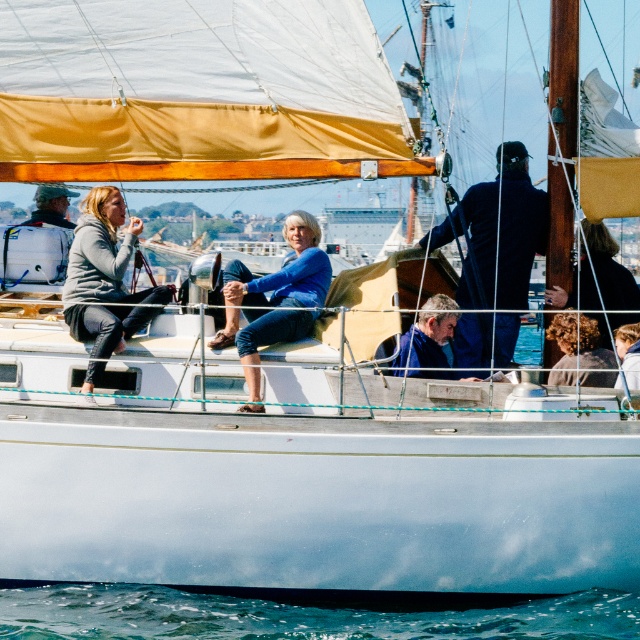
You are standing on the deck of the sailboat and want to reach the brown wooden mast at upper center. If your maximum reach is 2 meters, can you touch it with your hand?

The brown wooden mast at upper center is 31.06 meters from the camera, which is much farther than your 2 meter reach. You cannot touch it with your hand.

You are a sailor on the deck of the sailboat. You need to place a rectangular box that is 1 meter wide between the dark blue fabric at center and the blue denim jeans at center. Based on their widths, will the box fit without overlapping either object?

The dark blue fabric at center might be wider than blue denim jeans at center, so there is uncertainty about whether the 1 meter wide box will fit between them. You should measure the actual space before placing the box to ensure it doesn

You are a sailor trying to secure items on the deck of the sailboat. You have a dark blue fabric at center and blue denim jeans at center in your view. Which item should you secure first if you need to prioritize the taller object?

The dark blue fabric at center has a greater height compared to blue denim jeans at center, so you should secure the dark blue fabric at center first since it is taller.